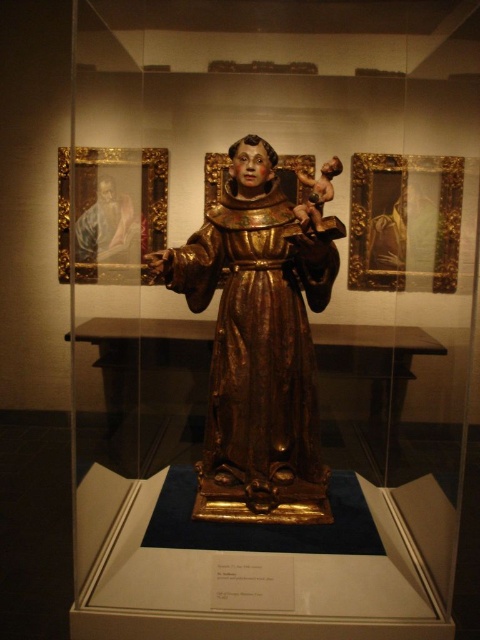
You are an art curator standing in front of the museum exhibit. You need to adjust the lighting to ensure both the gold polished wood statue at center and the matte gold frame at upper left are well illuminated. Which object should you focus the light on first if you want to highlight the one closer to the viewer?

The gold polished wood statue at center is closer to the viewer than the matte gold frame at upper left, so you should focus the light on the gold polished wood statue at center first.

You are an art curator planning to move the gold polished wood statue at center and the matte gold frame at upper left to a new exhibition space. The new space has a height restriction of 2 meters. Can both items fit under the height limit if placed individually?

The gold polished wood statue at center is much taller than the matte gold frame at upper left. Since the height restriction is 2 meters, we need to check both items individually. If the statue exceeds 2 meters in height, it cannot fit, but the frame might still be okay. However, without specific measurements, we can only confirm that the matte gold frame at upper left is shorter and likely under the limit, while the statue may or may not exceed it depending on its actual height.

You are a museum visitor standing in front of the glass case. You want to take a photo of the gold polished wood statue at center without any reflections from the glass. Based on its position, where should you aim your camera relative to the statue?

The gold polished wood statue at center is located at point [260,339], so you should aim your camera directly at the center coordinates to avoid reflections from the glass case.